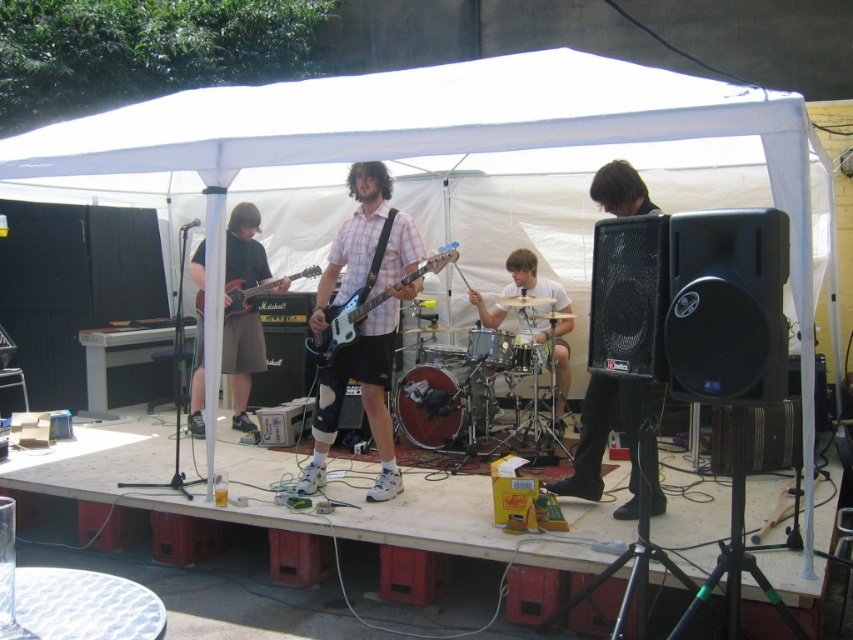
Based on the scene description, can you determine if the white drum set at center is located above or below the glossy electric guitar at center?

The white drum set at center is positioned under the glossy electric guitar at center, so it is located below.

You are a photographer setting up for the outdoor music performance. You need to position your camera so that both the plaid shirt at center and the black matte speaker at right are in frame. Considering their sizes, which object should you focus on first to ensure both are fully captured?

The plaid shirt at center has a smaller size compared to the black matte speaker at right. To ensure both are fully captured, focus on the smaller plaid shirt at center first, then adjust the frame to include the larger black matte speaker at right.